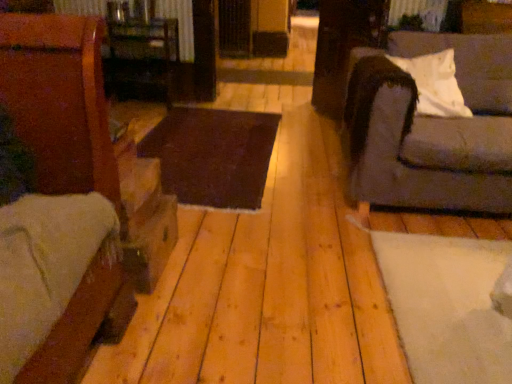
Question: Is gray fabric couch at right spatially inside natural wood floor at center, or outside of it?

Choices:
 (A) inside
 (B) outside

Answer: (B)

Question: In terms of size, does gray fabric couch at right appear bigger or smaller than natural wood floor at center?

Choices:
 (A) big
 (B) small

Answer: (A)

Question: Which object is positioned farthest from the wooden table at center, placed as the 2th table when sorted from bottom to top?

Choices:
 (A) natural wood floor at center
 (B) brown wood table at center, marked as the second table in a top-to-bottom arrangement
 (C) white soft pillow at right
 (D) gray fabric couch at right

Answer: (D)

Question: Which of these objects is positioned closest to the natural wood floor at center?

Choices:
 (A) white soft pillow at right
 (B) brown wood table at center, the first table in the bottom-to-top sequence
 (C) wooden table at center, the 1th table when ordered from top to bottom
 (D) gray fabric couch at right

Answer: (B)